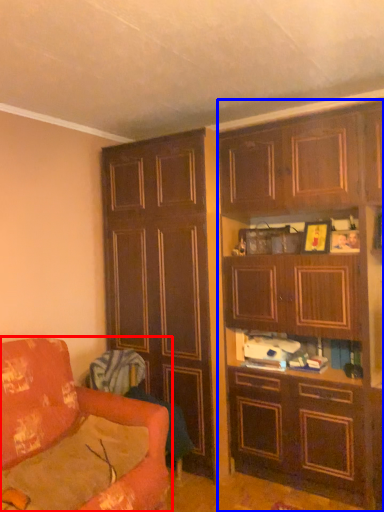
Question: Which object is closer to the camera taking this photo, studio couch (highlighted by a red box) or cabinetry (highlighted by a blue box)?

Choices:
 (A) studio couch
 (B) cabinetry

Answer: (A)